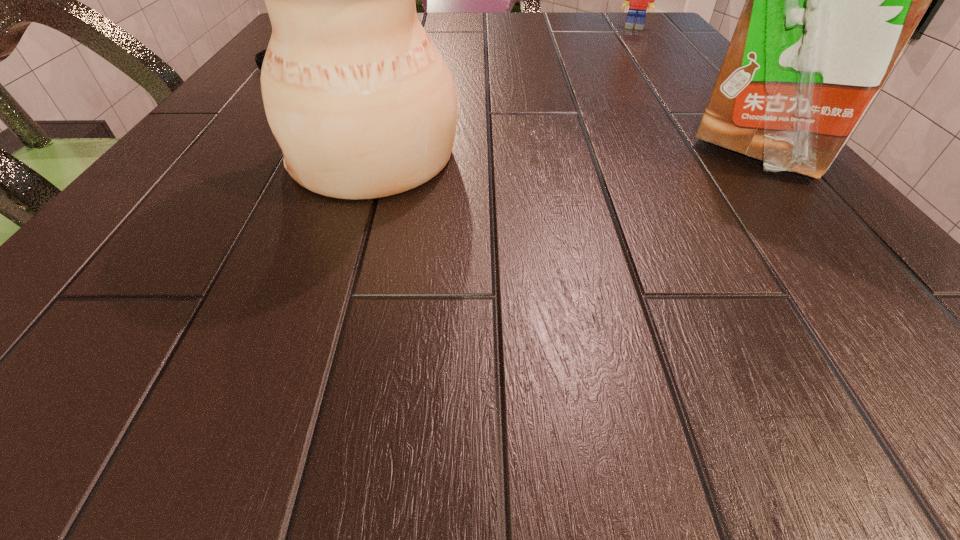
The height and width of the screenshot is (540, 960). Find the location of `free space between the pottery and the farthest object`. free space between the pottery and the farthest object is located at coordinates click(x=504, y=91).

Where is `free space between the carton and the Lego`? This screenshot has width=960, height=540. free space between the carton and the Lego is located at coordinates (696, 89).

The image size is (960, 540). I want to click on vacant point located between the carton and the Lego, so click(x=696, y=89).

You are a GUI agent. You are given a task and a screenshot of the screen. Output one action in this format:
    pyautogui.click(x=<x>, y=<y>)
    Task: Click on the vacant area that lies between the shortest object and the farthest object
    This screenshot has height=540, width=960.
    Given the screenshot: What is the action you would take?
    pyautogui.click(x=461, y=48)

Find the location of a particular element. The height and width of the screenshot is (540, 960). object identified as the third closest to the leftmost object is located at coordinates (639, 0).

Point out which object is positioned as the nearest to the pottery. Please provide its 2D coordinates. Your answer should be formatted as a tuple, i.e. [(x, y)], where the tuple contains the x and y coordinates of a point satisfying the conditions above.

[(259, 57)]

The height and width of the screenshot is (540, 960). Find the location of `vacant space that satisfies the following two spatial constraints: 1. on the front side of the pottery; 2. at the open side of the wristband`. vacant space that satisfies the following two spatial constraints: 1. on the front side of the pottery; 2. at the open side of the wristband is located at coordinates (220, 156).

Where is `vacant region that satisfies the following two spatial constraints: 1. on the back side of the shortest object; 2. on the right side of the farthest object`? This screenshot has height=540, width=960. vacant region that satisfies the following two spatial constraints: 1. on the back side of the shortest object; 2. on the right side of the farthest object is located at coordinates (319, 28).